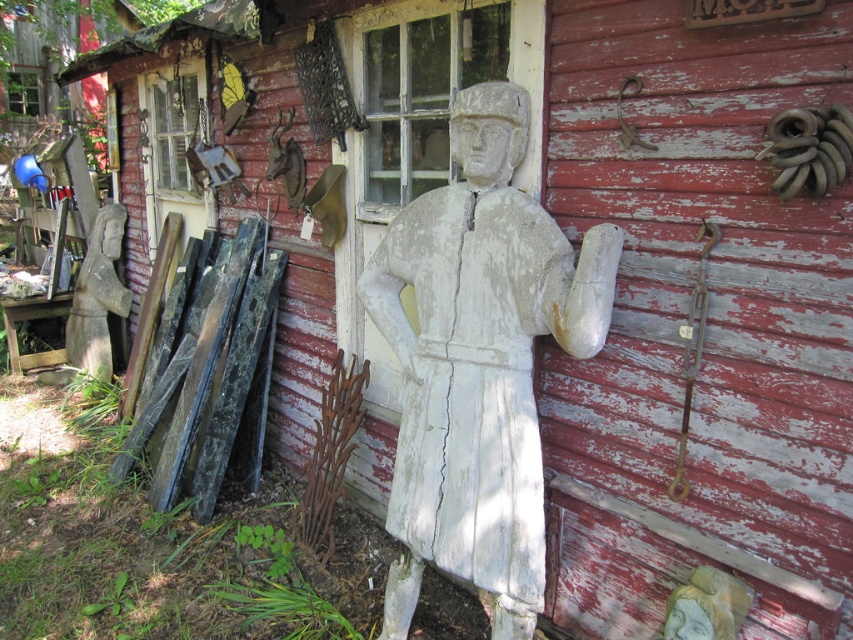
You are a painter who wants to place a ladder between the white weathered wood statue at center and the gray stone statue at left to reach the shed roof. Given that the ladder is 10 feet long, will it be long enough to safely reach both statues?

The distance between the white weathered wood statue at center and the gray stone statue at left is 12.91 feet. Since the ladder is only 10 feet long, it will not be long enough to safely span the distance between them.

You are an artist planning to place a new sculpture between the white weathered wood statue at center and the gray stone statue at left. Given their widths, which statue should you position closer to the center to maintain balance?

The white weathered wood statue at center is wider than the gray stone statue at left, so to maintain balance, position the wider white weathered wood statue at center closer to the center and the narrower gray stone statue at left further away.